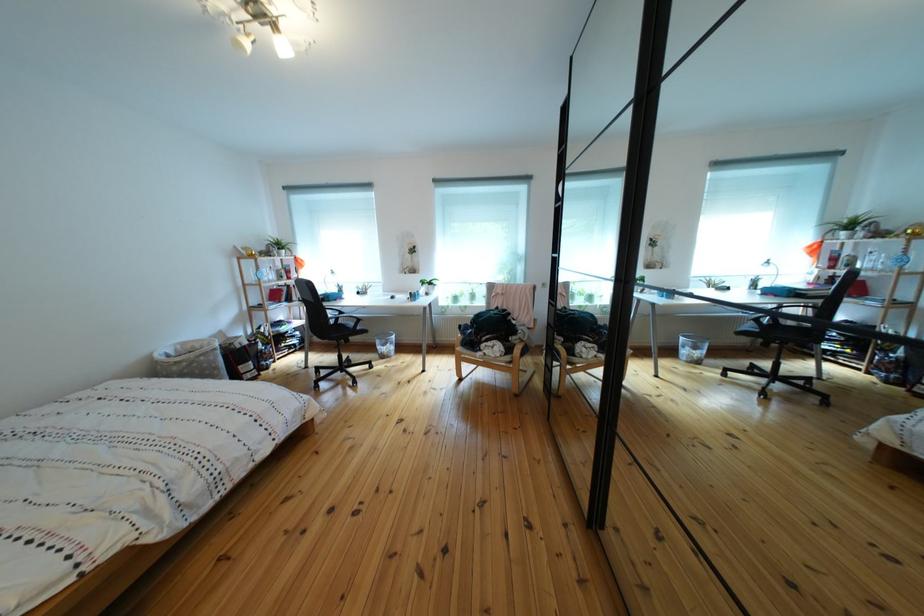
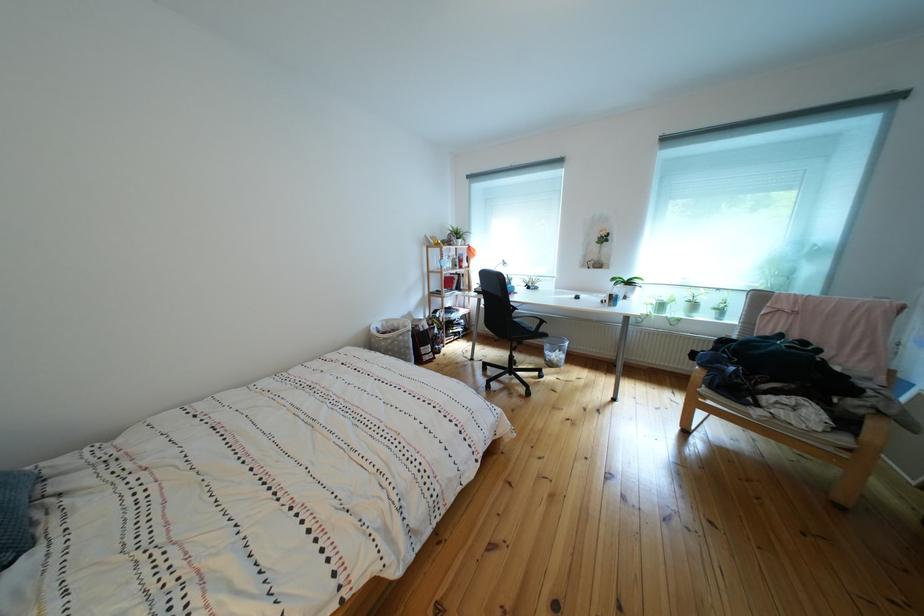
In a continuous first-person perspective shot, in which direction is the camera moving?

The cameraman moved toward left, forward.